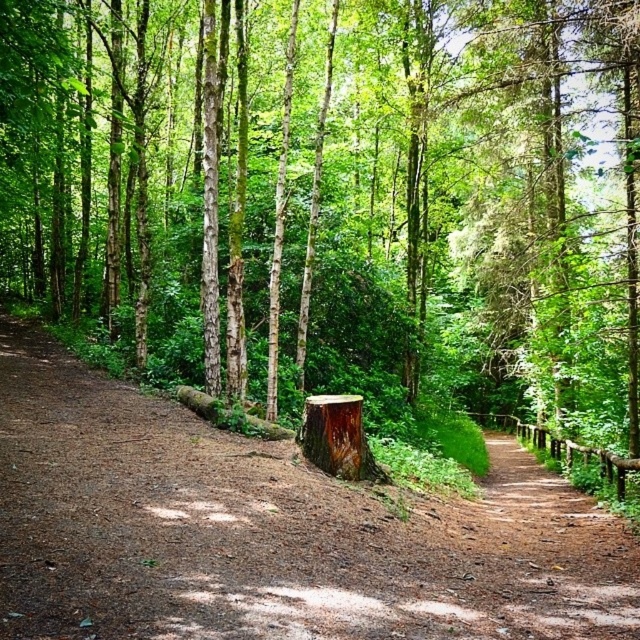
Question: Which point is farther to the camera?

Choices:
 (A) brown dirt path at center
 (B) brown rough tree stump at center

Answer: (B)

Question: Which point is closer to the camera?

Choices:
 (A) brown rough tree stump at center
 (B) rough wood stump at center

Answer: (A)

Question: Which of the following is the closest to the observer?

Choices:
 (A) (10, 579)
 (B) (250, 225)

Answer: (A)

Question: Does brown rough tree stump at center have a smaller size compared to rough wood stump at center?

Choices:
 (A) yes
 (B) no

Answer: (B)

Question: Is brown dirt path at center bigger than rough wood stump at center?

Choices:
 (A) yes
 (B) no

Answer: (A)

Question: Can you confirm if brown rough tree stump at center is wider than brown dirt path at center?

Choices:
 (A) yes
 (B) no

Answer: (A)